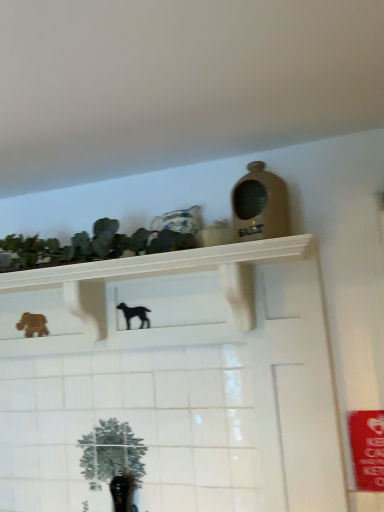
Question: Is the depth of black matte dog at center, which is counted as the first animal, starting from the front, less than that of green matte cactus at upper left?

Choices:
 (A) no
 (B) yes

Answer: (A)

Question: Is black matte dog at center, which appears as the 1th animal when viewed from the right, not within green matte cactus at upper left?

Choices:
 (A) yes
 (B) no

Answer: (A)

Question: Is black matte dog at center, which is the second animal from back to front, aimed at green matte cactus at upper left?

Choices:
 (A) no
 (B) yes

Answer: (A)

Question: Does black matte dog at center, the 2th animal positioned from the left, have a lesser height compared to green matte cactus at upper left?

Choices:
 (A) yes
 (B) no

Answer: (A)

Question: Considering the relative sizes of black matte dog at center, which appears as the 1th animal when viewed from the right, and green matte cactus at upper left in the image provided, is black matte dog at center, which appears as the 1th animal when viewed from the right, smaller than green matte cactus at upper left?

Choices:
 (A) yes
 (B) no

Answer: (A)

Question: Would you say wooden horse at left, which ranks as the 1th animal in left-to-right order, is to the left or to the right of green matte cactus at upper left in the picture?

Choices:
 (A) left
 (B) right

Answer: (A)

Question: Considering their positions, is wooden horse at left, the 2th animal viewed from the right, located in front of or behind green matte cactus at upper left?

Choices:
 (A) front
 (B) behind

Answer: (B)

Question: Considering the positions of wooden horse at left, the 2th animal viewed from the right, and green matte cactus at upper left in the image, is wooden horse at left, the 2th animal viewed from the right, taller or shorter than green matte cactus at upper left?

Choices:
 (A) short
 (B) tall

Answer: (A)

Question: From the image's perspective, relative to green matte cactus at upper left, is wooden horse at left, the 2th animal viewed from the right, above or below?

Choices:
 (A) below
 (B) above

Answer: (A)

Question: In terms of size, does wooden horse at left, the second animal in the front-to-back sequence, appear bigger or smaller than black matte dog at center, the 2th animal positioned from the left?

Choices:
 (A) small
 (B) big

Answer: (B)

Question: Relative to black matte dog at center, the 2th animal positioned from the left, is wooden horse at left, the 2th animal viewed from the right, in front or behind?

Choices:
 (A) front
 (B) behind

Answer: (B)

Question: Would you say wooden horse at left, which is the 1th animal in back-to-front order, is inside or outside black matte dog at center, which is counted as the first animal, starting from the front?

Choices:
 (A) outside
 (B) inside

Answer: (A)

Question: Would you say wooden horse at left, which ranks as the 1th animal in left-to-right order, is to the left or to the right of black matte dog at center, the 2th animal positioned from the left, in the picture?

Choices:
 (A) left
 (B) right

Answer: (A)

Question: In terms of width, does wooden horse at left, which ranks as the 1th animal in left-to-right order, look wider or thinner when compared to white glossy shelf at upper center?

Choices:
 (A) thin
 (B) wide

Answer: (A)

Question: Would you say wooden horse at left, which ranks as the 1th animal in left-to-right order, is to the left or to the right of white glossy shelf at upper center in the picture?

Choices:
 (A) right
 (B) left

Answer: (B)